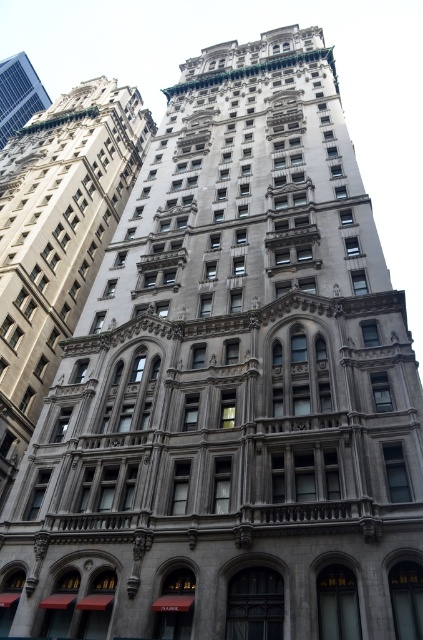
Question: Is silver metallic building at center closer to camera compared to metallic solar panel at upper left?

Choices:
 (A) yes
 (B) no

Answer: (A)

Question: Which object is farther from the camera taking this photo?

Choices:
 (A) metallic solar panel at upper left
 (B) silver metallic building at center

Answer: (A)

Question: From the image, what is the correct spatial relationship of silver metallic building at center in relation to metallic solar panel at upper left?

Choices:
 (A) left
 (B) right

Answer: (B)

Question: Considering the relative positions of silver metallic building at center and metallic solar panel at upper left in the image provided, where is silver metallic building at center located with respect to metallic solar panel at upper left?

Choices:
 (A) left
 (B) right

Answer: (B)

Question: Which object appears closest to the camera in this image?

Choices:
 (A) metallic solar panel at upper left
 (B) silver metallic building at center

Answer: (B)